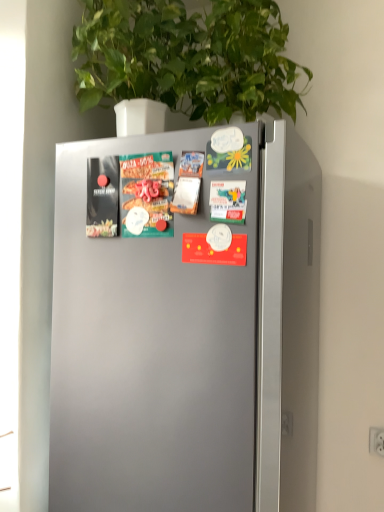
Question: Considering the relative sizes of matte cardboard pizza box at center left and green leafy plant at upper center in the image provided, is matte cardboard pizza box at center left thinner than green leafy plant at upper center?

Choices:
 (A) yes
 (B) no

Answer: (A)

Question: From the image's perspective, is matte cardboard pizza box at center left on top of green leafy plant at upper center?

Choices:
 (A) no
 (B) yes

Answer: (A)

Question: Is matte cardboard pizza box at center left completely or partially outside of green leafy plant at upper center?

Choices:
 (A) yes
 (B) no

Answer: (A)

Question: From the image's perspective, is matte cardboard pizza box at center left beneath green leafy plant at upper center?

Choices:
 (A) no
 (B) yes

Answer: (B)

Question: Considering the relative sizes of matte cardboard pizza box at center left and green leafy plant at upper center in the image provided, is matte cardboard pizza box at center left taller than green leafy plant at upper center?

Choices:
 (A) yes
 (B) no

Answer: (B)

Question: Is matte cardboard pizza box at center left closer to camera compared to green leafy plant at upper center?

Choices:
 (A) yes
 (B) no

Answer: (B)

Question: From the image's perspective, is green leafy plant at upper center beneath matte cardboard pizza box at center left?

Choices:
 (A) no
 (B) yes

Answer: (A)

Question: Can you confirm if green leafy plant at upper center is bigger than matte cardboard pizza box at center left?

Choices:
 (A) no
 (B) yes

Answer: (B)

Question: Is green leafy plant at upper center turned away from matte cardboard pizza box at center left?

Choices:
 (A) yes
 (B) no

Answer: (B)

Question: From a real-world perspective, is green leafy plant at upper center beneath matte cardboard pizza box at center left?

Choices:
 (A) no
 (B) yes

Answer: (A)

Question: Does green leafy plant at upper center have a greater height compared to matte cardboard pizza box at center left?

Choices:
 (A) no
 (B) yes

Answer: (B)

Question: Would you say matte cardboard pizza box at center left is part of green leafy plant at upper center's contents?

Choices:
 (A) yes
 (B) no

Answer: (B)

Question: Is green leafy plant at upper center in front of or behind matte cardboard pizza box at center left in the image?

Choices:
 (A) behind
 (B) front

Answer: (B)